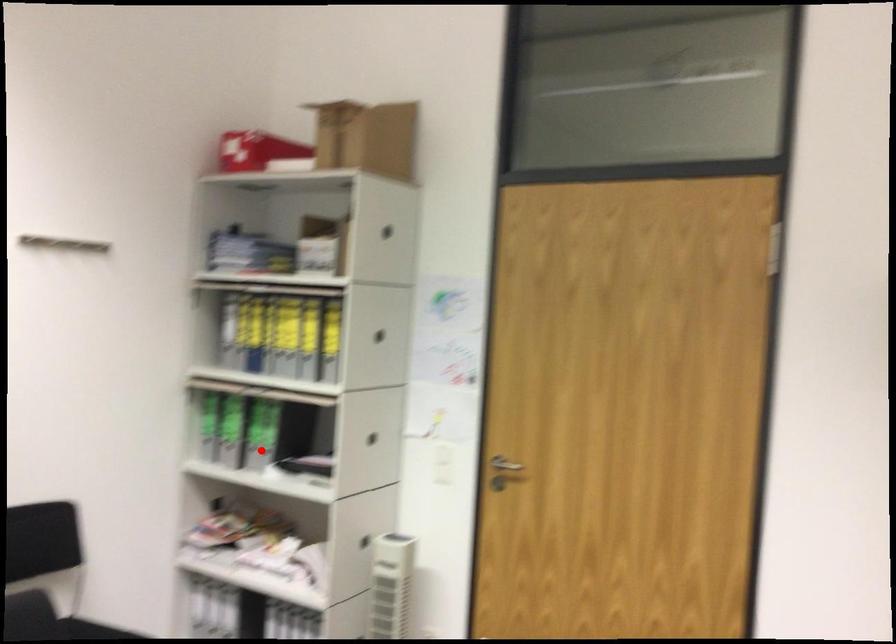
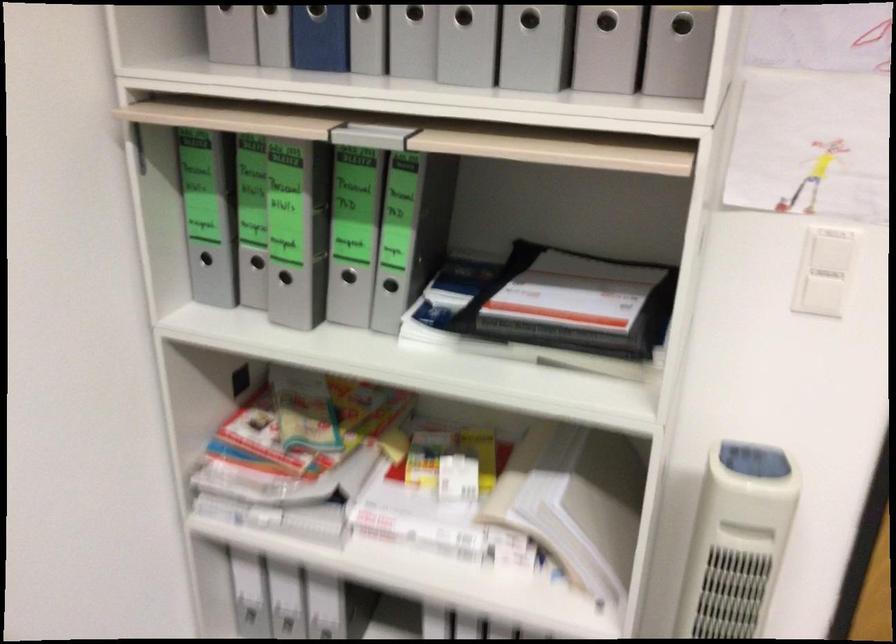
Question: I am providing you with two images of the same scene from different viewpoints. Image1 has a red point marked. In image2, the corresponding 3D location appears at what relative position? Reply with the corresponding letter.

Choices:
 (A) Closer
 (B) Farther

Answer: (A)